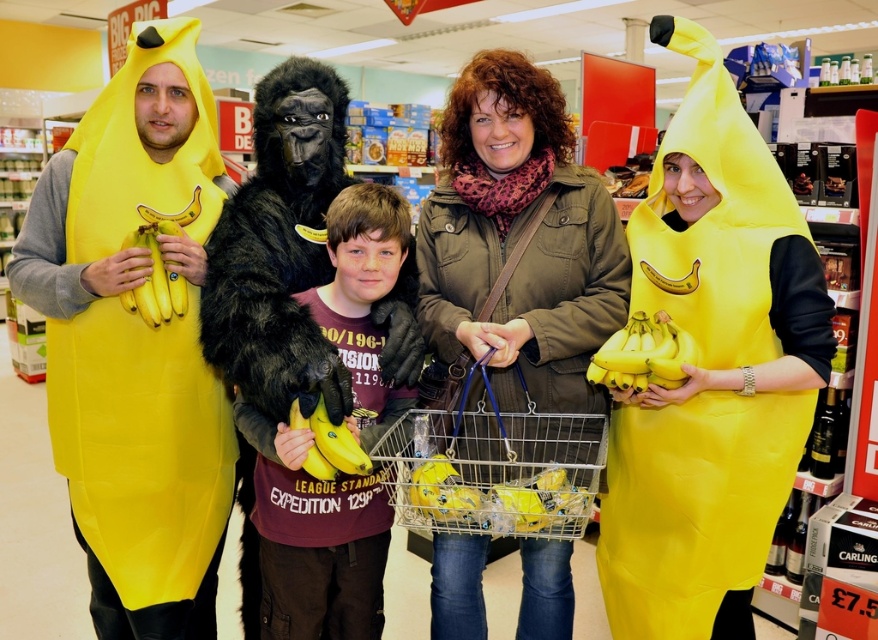
Who is taller, matte yellow banana at left or matte yellow costume at center?

Standing taller between the two is matte yellow banana at left.

Measure the distance from matte yellow banana at left to matte yellow costume at center.

A distance of 1.20 meters exists between matte yellow banana at left and matte yellow costume at center.

You are a GUI agent. You are given a task and a screenshot of the screen. Output one action in this format:
    pyautogui.click(x=<x>, y=<y>)
    Task: Click on the matte yellow banana at left
    Image resolution: width=878 pixels, height=640 pixels.
    Given the screenshot: What is the action you would take?
    pyautogui.click(x=135, y=340)

This screenshot has height=640, width=878. In order to click on matte yellow banana at left in this screenshot , I will do `click(135, 340)`.

Is matte olive green jacket at center taller than yellow matte bananas at right?

Yes, matte olive green jacket at center is taller than yellow matte bananas at right.

Can you confirm if matte olive green jacket at center is bigger than yellow matte bananas at right?

Yes, matte olive green jacket at center is bigger than yellow matte bananas at right.

Identify the location of matte olive green jacket at center. 517,241.

Which is below, yellow matte bananas at right or yellow matte banana at center?

Positioned lower is yellow matte banana at center.

Between yellow matte bananas at right and yellow matte banana at center, which one appears on the right side from the viewer's perspective?

yellow matte bananas at right

Who is more forward, (x=645, y=352) or (x=335, y=440)?

Point (x=335, y=440) is more forward.

This screenshot has height=640, width=878. What are the coordinates of `yellow matte bananas at right` in the screenshot? It's located at (643, 355).